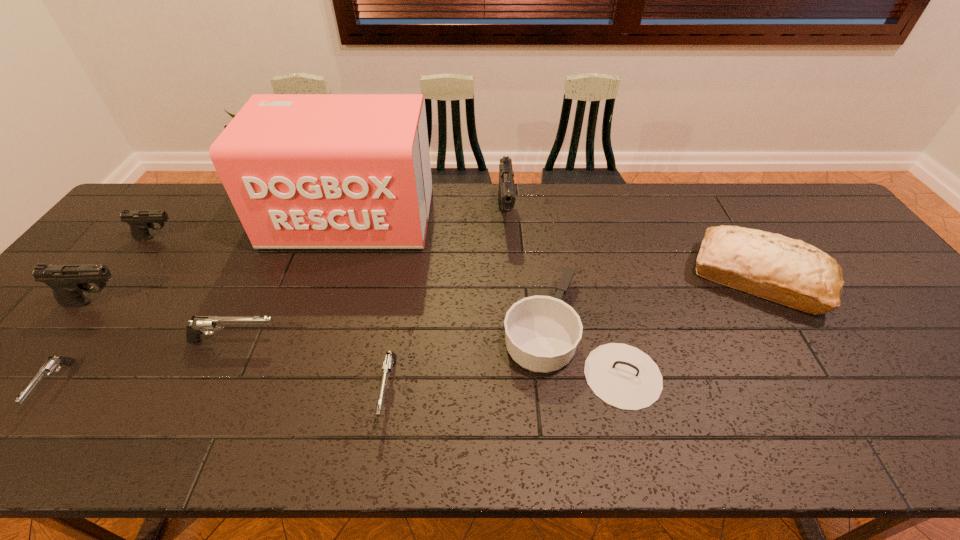
Identify the location of free space located on the front-facing side of the third nearest pistol. (416, 341).

Locate an element on the screen. This screenshot has height=540, width=960. blank space located on the back of the saucepan is located at coordinates (549, 194).

Where is `box present at the far edge`? The image size is (960, 540). box present at the far edge is located at coordinates (303, 171).

The image size is (960, 540). I want to click on pistol located at the far edge, so click(x=506, y=194).

Where is `object at the right edge`? The height and width of the screenshot is (540, 960). object at the right edge is located at coordinates (791, 272).

The image size is (960, 540). What are the coordinates of `object positioned at the near left corner` in the screenshot? It's located at (49, 366).

I want to click on free space at the far edge of the desktop, so click(476, 188).

This screenshot has width=960, height=540. I want to click on free space at the near edge of the desktop, so click(648, 420).

Locate an element on the screen. The image size is (960, 540). free region at the left edge is located at coordinates (128, 276).

Where is `vacant region at the right edge of the desktop`? This screenshot has height=540, width=960. vacant region at the right edge of the desktop is located at coordinates (924, 348).